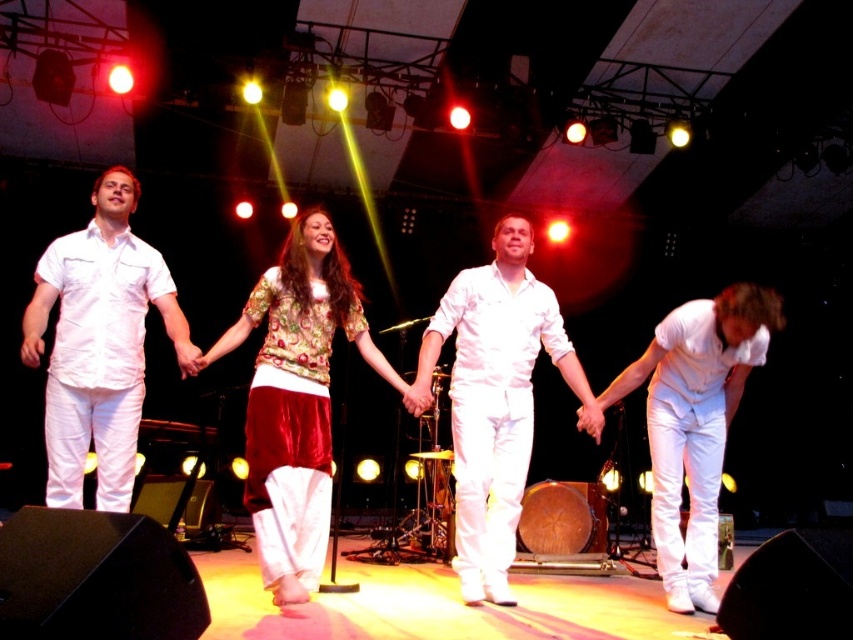
You are a stagehand who needs to adjust the height of the spotlight for two performers at the center of the stage. The spotlight needs to be set at a height that accommodates both the velvet floral top at center and the white satin jumpsuit at center. Which performer should the spotlight be raised higher for, the one with the shorter or taller outfit?

The spotlight should be raised higher for the white satin jumpsuit at center because it is taller than the velvet floral top at center.

You are a photographer at the back of the stage. You need to capture a photo where the velvet floral top at center is on the left side of the white satin jumpsuit at center. Does the current arrangement allow this?

Yes, the velvet floral top at center is already positioned to the left of the white satin jumpsuit at center, so the current arrangement allows the velvet floral top at center to be on the left side of the white satin jumpsuit at center in the photo.

You are a stagehand at the concert and need to place a small prop on the stage. The prop must be placed between the two points, point(300, 436) and point(68, 483). According to the stage layout, where should you position the prop relative to these two points?

The prop should be placed between point(300, 436) and point(68, 483), closer to point(68, 483) since point(300, 436) is behind it.